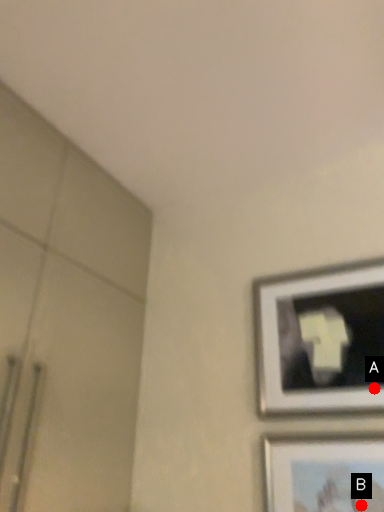
Question: Two points are circled on the image, labeled by A and B beside each circle. Among these points, which one is farthest from the camera?

Choices:
 (A) A is further
 (B) B is further

Answer: (A)